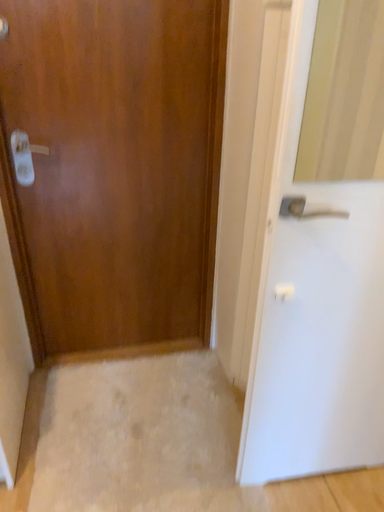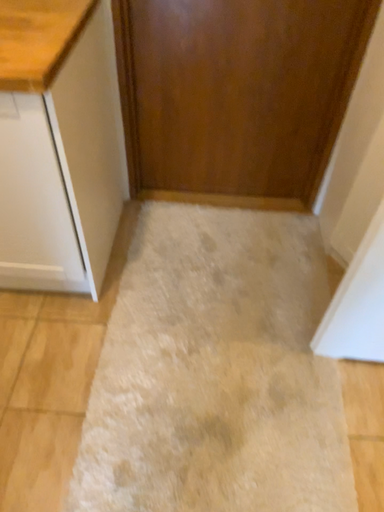
Question: How did the camera likely rotate when shooting the video?

Choices:
 (A) rotated downward
 (B) rotated upward

Answer: (A)